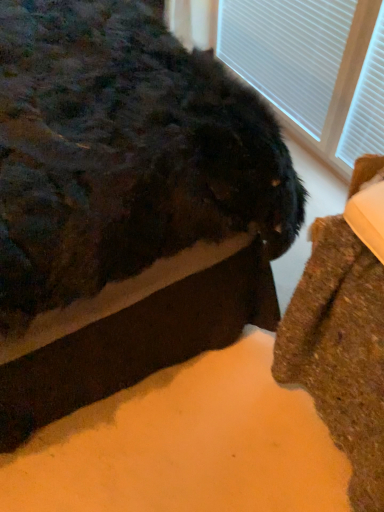
Question: From a real-world perspective, is fuzzy black cat at lower right physically below white textured blinds at upper right?

Choices:
 (A) yes
 (B) no

Answer: (B)

Question: Could you tell me if fuzzy black cat at lower right is facing white textured blinds at upper right?

Choices:
 (A) yes
 (B) no

Answer: (B)

Question: Does fuzzy black cat at lower right come in front of white textured blinds at upper right?

Choices:
 (A) no
 (B) yes

Answer: (B)

Question: Considering the relative sizes of fuzzy black cat at lower right and white textured blinds at upper right in the image provided, is fuzzy black cat at lower right taller than white textured blinds at upper right?

Choices:
 (A) yes
 (B) no

Answer: (A)

Question: Does fuzzy black cat at lower right appear on the right side of white textured blinds at upper right?

Choices:
 (A) no
 (B) yes

Answer: (A)

Question: From the image's perspective, would you say fuzzy black cat at lower right is positioned over white textured blinds at upper right?

Choices:
 (A) yes
 (B) no

Answer: (B)

Question: Could fuzzy black cat at lower right be considered to be inside white textured blinds at upper right?

Choices:
 (A) yes
 (B) no

Answer: (B)

Question: Is white textured blinds at upper right bigger than fuzzy black cat at lower right?

Choices:
 (A) no
 (B) yes

Answer: (A)

Question: From the image's perspective, is white textured blinds at upper right on top of fuzzy black cat at lower right?

Choices:
 (A) no
 (B) yes

Answer: (B)

Question: Can we say white textured blinds at upper right lies outside fuzzy black cat at lower right?

Choices:
 (A) yes
 (B) no

Answer: (A)

Question: Is white textured blinds at upper right shorter than fuzzy black cat at lower right?

Choices:
 (A) yes
 (B) no

Answer: (A)

Question: From the image's perspective, does white textured blinds at upper right appear lower than fuzzy black cat at lower right?

Choices:
 (A) yes
 (B) no

Answer: (B)

Question: Is brown textured rug at lower right at the back of fuzzy black cat at lower right?

Choices:
 (A) yes
 (B) no

Answer: (B)